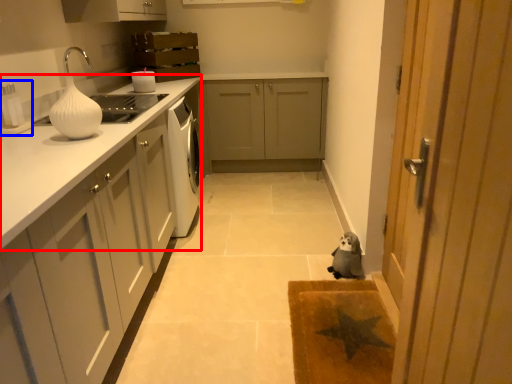
Question: Which object is further to the camera taking this photo, countertop (highlighted by a red box) or appliance (highlighted by a blue box)?

Choices:
 (A) countertop
 (B) appliance

Answer: (A)